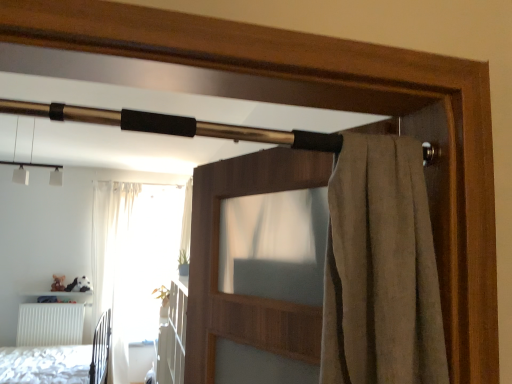
Question: Is white textured bed at lower left taller or shorter than white sheer curtain at left?

Choices:
 (A) short
 (B) tall

Answer: (A)

Question: In the image, is white textured bed at lower left on the left side or the right side of white sheer curtain at left?

Choices:
 (A) right
 (B) left

Answer: (B)

Question: Considering the real-world distances, which object is farthest from the white textured bed at lower left?

Choices:
 (A) white matte radiator at lower left
 (B) brown fabric screen door at upper center
 (C) white sheer curtain at left

Answer: (B)

Question: Estimate the real-world distances between objects in this image. Which object is farther from the brown fabric screen door at upper center?

Choices:
 (A) white textured bed at lower left
 (B) white matte radiator at lower left
 (C) white sheer curtain at left

Answer: (B)